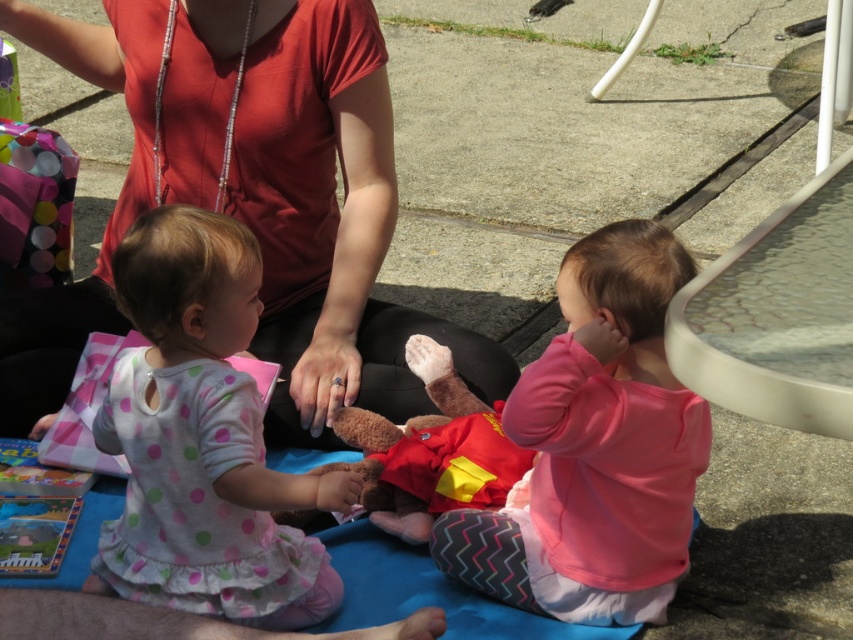
Is point (309, 550) in front of point (553, 422)?

No, it is behind (553, 422).

This screenshot has height=640, width=853. In order to click on white polka dot fabric at center in this screenshot , I will do `click(202, 440)`.

What do you see at coordinates (202, 440) in the screenshot?
I see `white polka dot fabric at center` at bounding box center [202, 440].

Locate an element on the screen. white polka dot fabric at center is located at coordinates (202, 440).

Who is more forward, (196,189) or (209,374)?

Point (209,374)

Is matte red shirt at center bigger than white polka dot fabric at center?

Correct, matte red shirt at center is larger in size than white polka dot fabric at center.

Does point (212, 99) lie in front of point (233, 317)?

No, (212, 99) is further to viewer.

Find the location of a particular element. This screenshot has height=640, width=853. matte red shirt at center is located at coordinates (248, 198).

Does matte red shirt at center have a larger size compared to pink fleece sweater at center?

Indeed, matte red shirt at center has a larger size compared to pink fleece sweater at center.

Does matte red shirt at center have a lesser height compared to pink fleece sweater at center?

No.

Image resolution: width=853 pixels, height=640 pixels. What are the coordinates of `matte red shirt at center` in the screenshot? It's located at (248, 198).

Find the location of a particular element. The image size is (853, 640). matte red shirt at center is located at coordinates (248, 198).